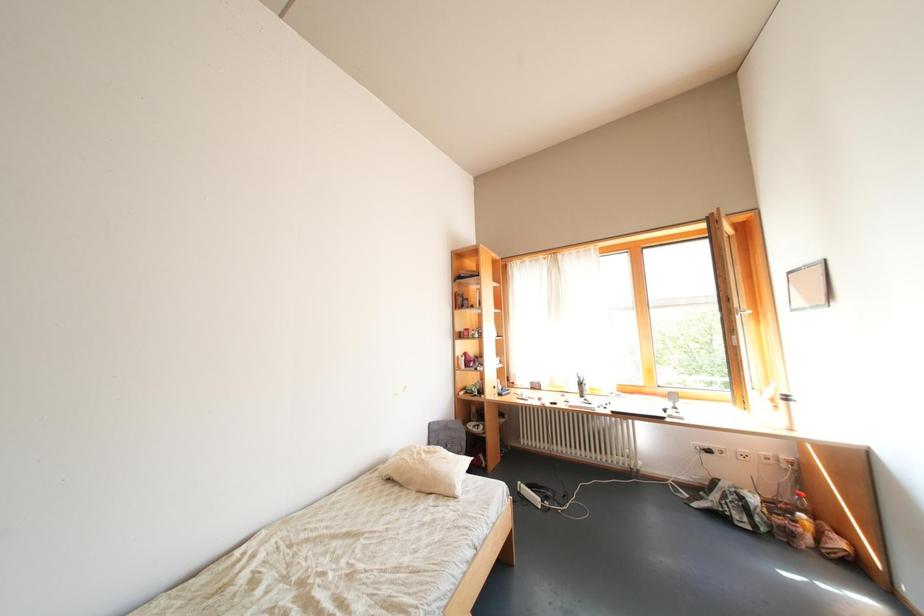
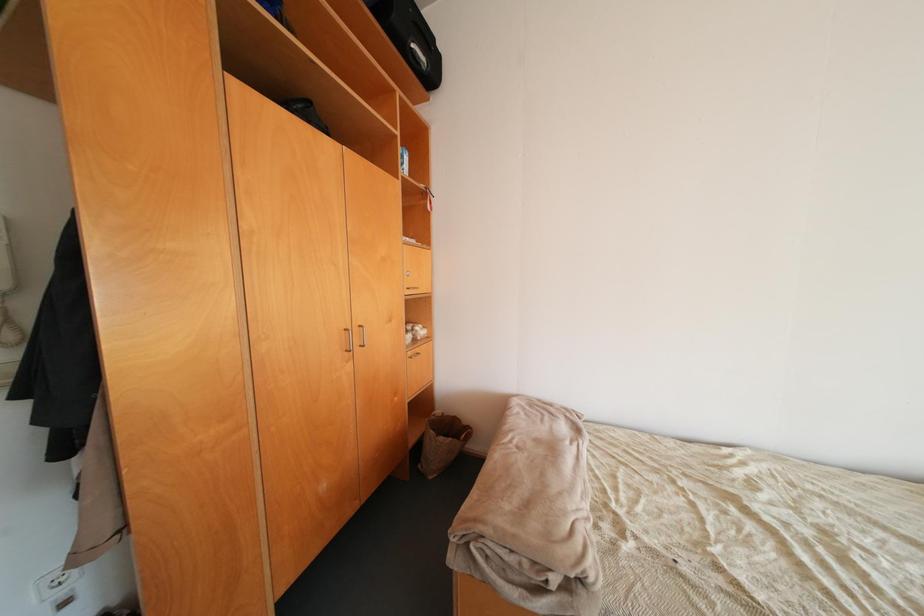
Question: How did the camera likely rotate?

Choices:
 (A) Left
 (B) Right
 (C) Up
 (D) Down

Answer: (A)